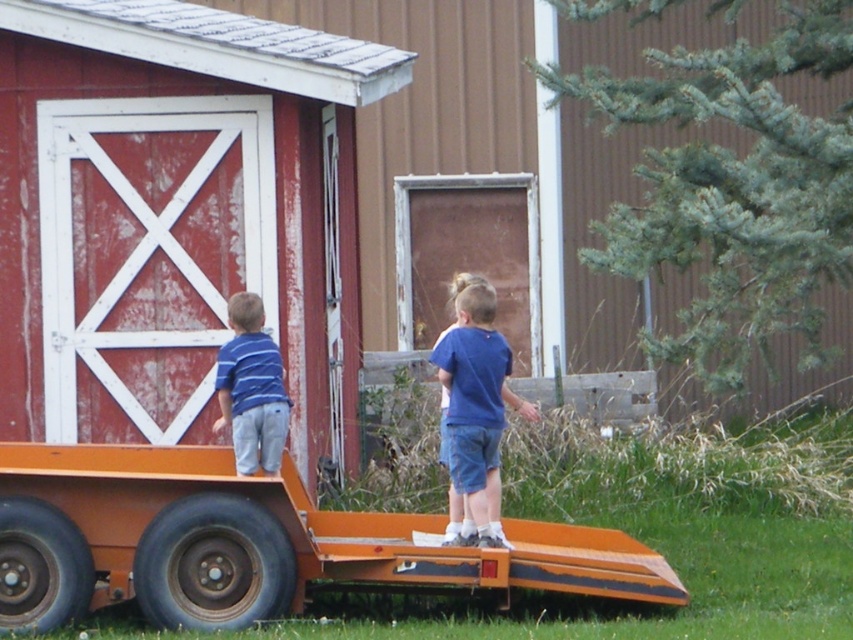
Is blue cotton shirt at center positioned behind blue striped shirt at left?

No.

Is blue cotton shirt at center above blue striped shirt at left?

Incorrect, blue cotton shirt at center is not positioned above blue striped shirt at left.

Where is `blue cotton shirt at center`? Image resolution: width=853 pixels, height=640 pixels. blue cotton shirt at center is located at coordinates (476, 410).

Locate an element on the screen. blue cotton shirt at center is located at coordinates (476, 410).

Between red painted wood barn door at left and blue cotton shirt at center, which one is positioned lower?

blue cotton shirt at center is below.

Is point (207, 378) farther from viewer compared to point (474, 492)?

Yes, point (207, 378) is behind point (474, 492).

Does point (138, 337) lie in front of point (457, 401)?

No, (138, 337) is further to viewer.

You are a GUI agent. You are given a task and a screenshot of the screen. Output one action in this format:
    pyautogui.click(x=<x>, y=<y>)
    Task: Click on the red painted wood barn door at left
    The width and height of the screenshot is (853, 640).
    Given the screenshot: What is the action you would take?
    pyautogui.click(x=148, y=250)

Does orange matte trailer truck at lower left come in front of blue cotton shirt at center?

Yes, orange matte trailer truck at lower left is in front of blue cotton shirt at center.

Can you confirm if orange matte trailer truck at lower left is bigger than blue cotton shirt at center?

Yes.

This screenshot has width=853, height=640. I want to click on orange matte trailer truck at lower left, so click(x=251, y=541).